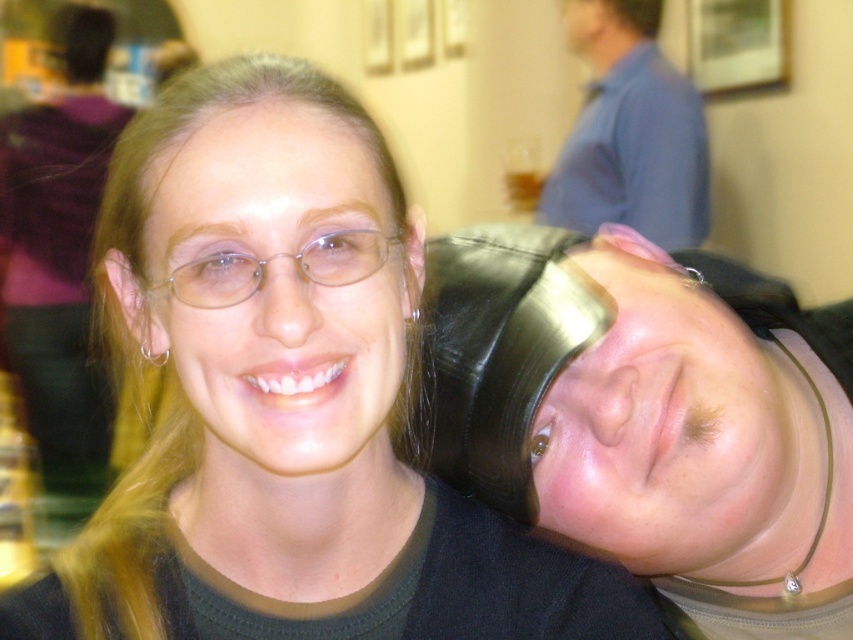
Consider the image. You are a photographer at a social event. You notice the matte black hair at center and the blue shirt at upper center in your frame. Which object is positioned lower in the image?

The matte black hair at center is positioned below the blue shirt at upper center, so the matte black hair at center is lower in the image.

You are at a social event and see the black leather hat at right and the blue shirt at upper center. Which object is shorter in height?

The black leather hat at right has a lesser height compared to the blue shirt at upper center, so the black leather hat at right is shorter.